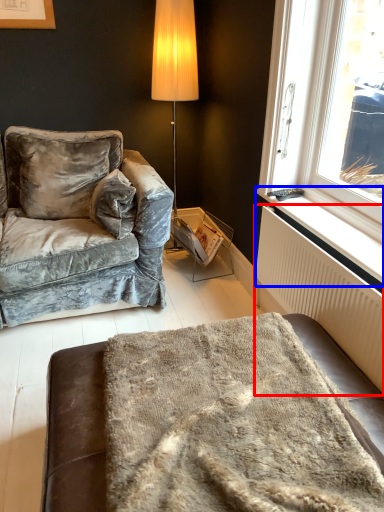
Question: Which point is further to the camera, radiator (highlighted by a red box) or window sill (highlighted by a blue box)?

Choices:
 (A) radiator
 (B) window sill

Answer: (B)